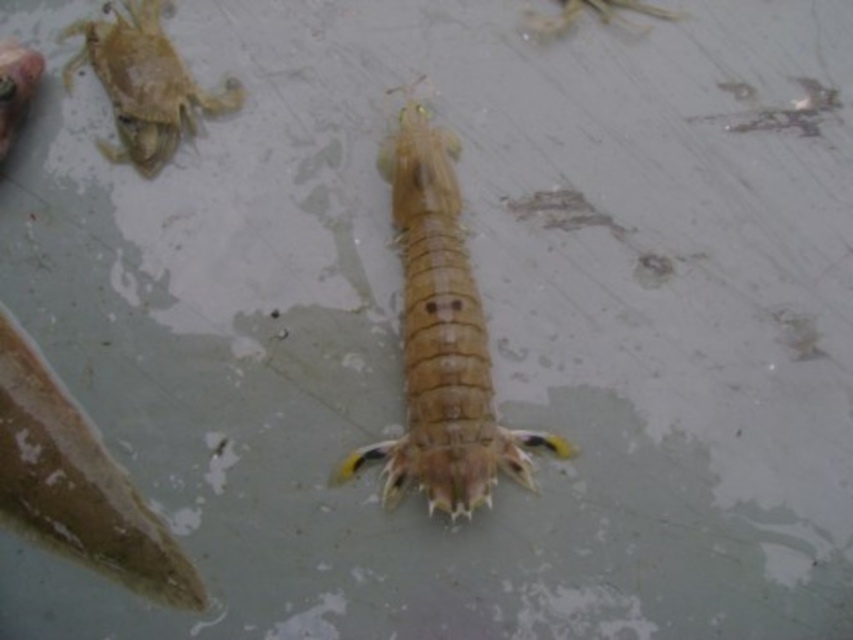
From the picture: You are a marine biologist examining the image. You notice two translucent creatures. Which one is taller between the translucent yellowish crustacean at center and the translucent yellow crab at upper left?

The translucent yellowish crustacean at center is much taller than the translucent yellow crab at upper left.

Consider the image. Based on the scene description, where is the translucent yellowish crustacean at center positioned in relation to the concrete surface?

The translucent yellowish crustacean at center is positioned centrally on the concrete surface, lying horizontally at point coordinates approximately 0.534 on the x and 0.518 on the y axis.